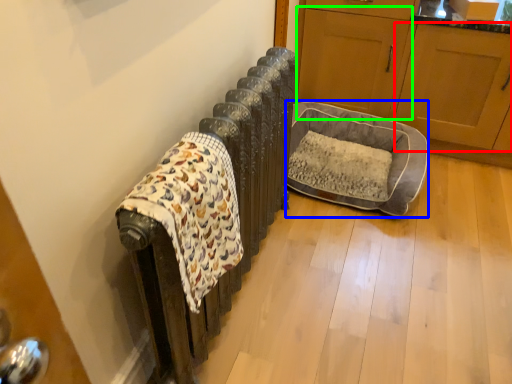
Question: Which object is the farthest from screen door (highlighted by a red box)? Choose among these: dog bed (highlighted by a blue box) or screen door (highlighted by a green box).

Choices:
 (A) dog bed
 (B) screen door

Answer: (A)